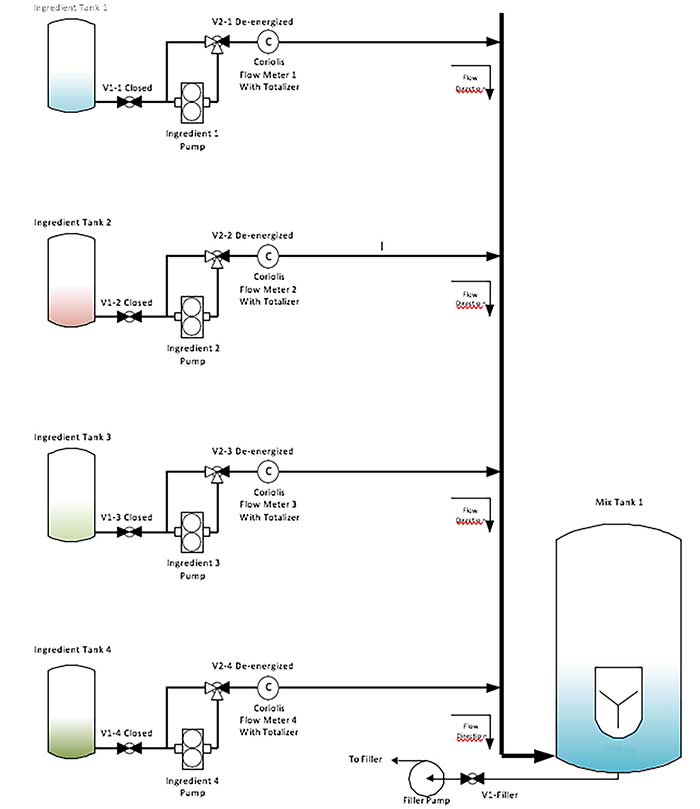
The image size is (700, 809). Identify the location of boxes. (66, 492), (70, 712), (633, 598), (64, 276), (77, 60).